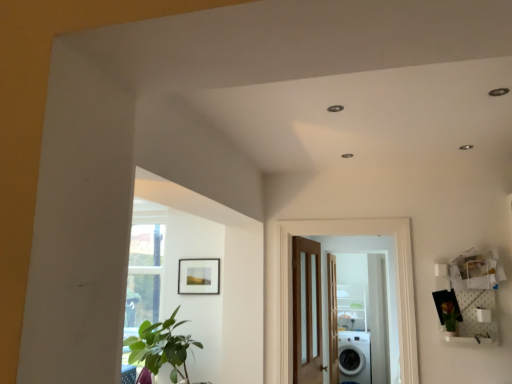
Question: From a real-world perspective, is white glossy washing machine at lower right physically located above or below green leafy plant at right?

Choices:
 (A) below
 (B) above

Answer: (A)

Question: From the image's perspective, is white glossy washing machine at lower right located above or below green leafy plant at right?

Choices:
 (A) below
 (B) above

Answer: (A)

Question: Which object is positioned farthest from the green leafy plant at lower left?

Choices:
 (A) brown wooden door at center, the third door viewed from the back
 (B) white glossy washing machine at lower right
 (C) matte wooden picture frame at upper center
 (D) wooden door at center, marked as the first door in a back-to-front arrangement
 (E) wooden door with glass panels at center, which is the second door from back to front

Answer: (B)

Question: Estimate the real-world distances between objects in this image. Which object is farther from the green leafy plant at right?

Choices:
 (A) green leafy plant at lower left
 (B) wooden door at center, marked as the first door in a back-to-front arrangement
 (C) white glossy washing machine at lower right
 (D) wooden door with glass panels at center, acting as the 2th door starting from the front
 (E) white glossy screen door at center

Answer: (E)